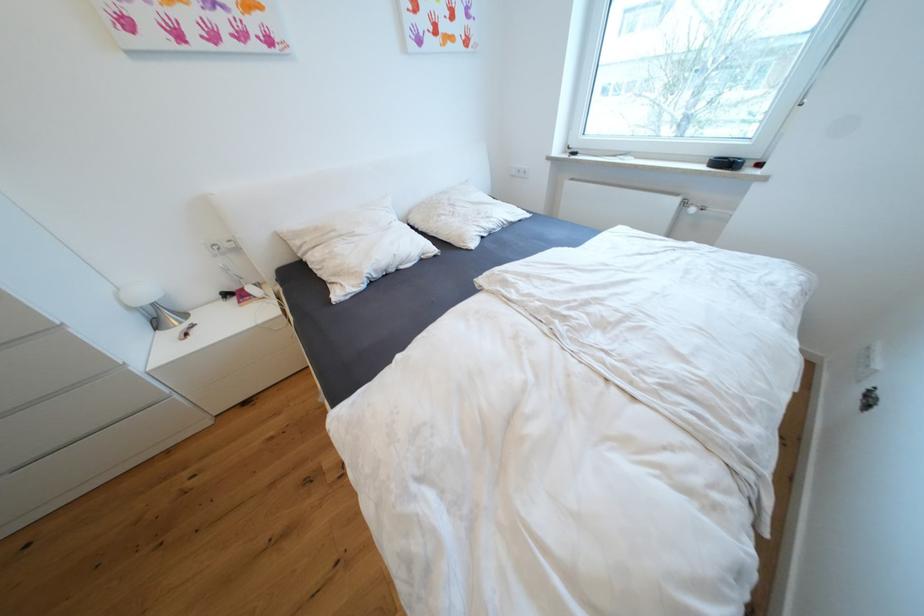
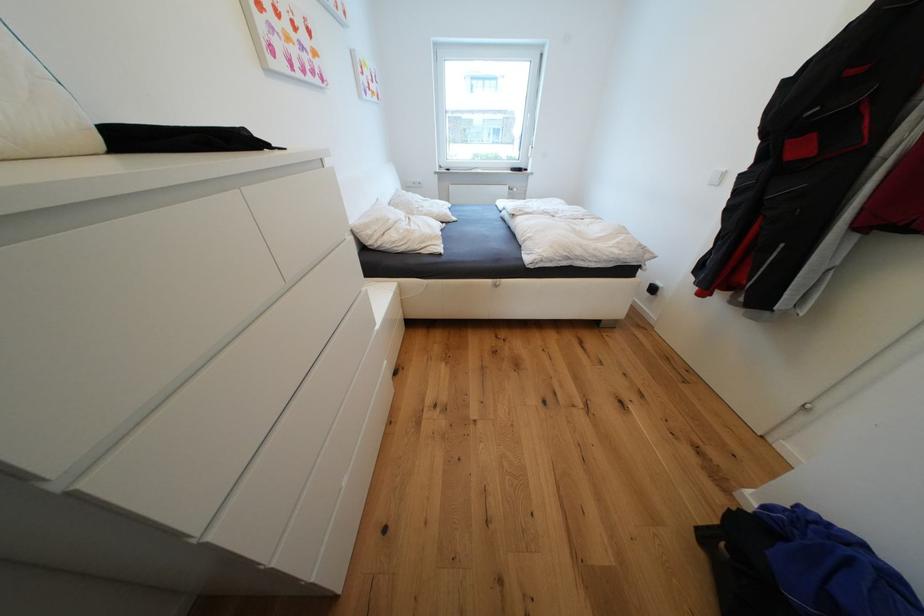
The point at [305,244] is marked in the first image. Where is the corresponding point in the second image?

(377, 233)